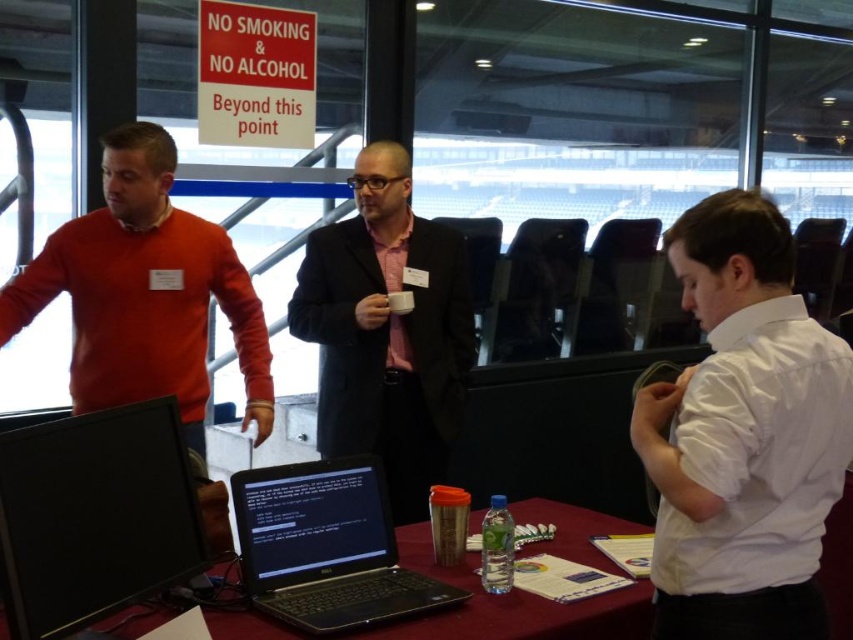
Locate an element on the screen. This screenshot has width=853, height=640. pink satin shirt at center is located at coordinates (387, 330).

Does pink satin shirt at center appear on the left side of black plastic laptop at center?

Incorrect, pink satin shirt at center is not on the left side of black plastic laptop at center.

Does point (413, 518) lie in front of point (376, 518)?

No, (413, 518) is behind (376, 518).

Find the location of a particular element. This screenshot has width=853, height=640. pink satin shirt at center is located at coordinates (387, 330).

Between white smooth shirt at right and black glossy monitor at lower left, which one has less height?

black glossy monitor at lower left is shorter.

How far apart are white smooth shirt at right and black glossy monitor at lower left?

A distance of 38.53 inches exists between white smooth shirt at right and black glossy monitor at lower left.

Measure the distance between white smooth shirt at right and camera.

4.04 feet

Where is `white smooth shirt at right`? white smooth shirt at right is located at coordinates (744, 435).

What do you see at coordinates (94, 516) in the screenshot? I see `black glossy monitor at lower left` at bounding box center [94, 516].

Is black glossy monitor at lower left smaller than black plastic laptop at center?

Indeed, black glossy monitor at lower left has a smaller size compared to black plastic laptop at center.

Measure the distance between black glossy monitor at lower left and camera.

black glossy monitor at lower left is 1.19 meters from camera.

You are a GUI agent. You are given a task and a screenshot of the screen. Output one action in this format:
    pyautogui.click(x=<x>, y=<y>)
    Task: Click on the black glossy monitor at lower left
    This screenshot has width=853, height=640.
    Given the screenshot: What is the action you would take?
    pyautogui.click(x=94, y=516)